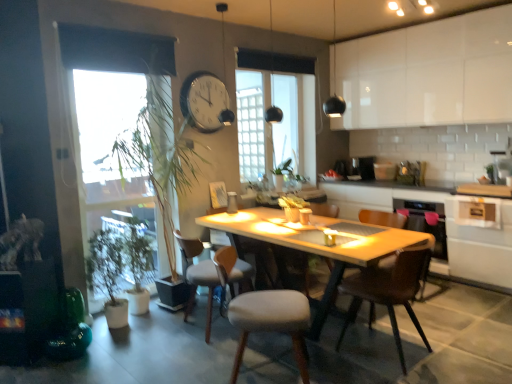
Question: From the image's perspective, is clear glass window at center located above or below white glossy counter at center?

Choices:
 (A) below
 (B) above

Answer: (B)

Question: From a real-world perspective, relative to white glossy counter at center, is clear glass window at center vertically above or below?

Choices:
 (A) below
 (B) above

Answer: (B)

Question: Which of these objects is positioned closest to the green leafy plant at left?

Choices:
 (A) white glossy cabinet at lower right, which is counted as the first cabinetry, starting from the bottom
 (B) light gray fabric chair at center, which appears as the first chair when viewed from the front
 (C) wooden chair at center, the first chair from the back
 (D) light gray fabric chair at center, positioned as the 3th chair in back-to-front order
 (E) white plastic clock at upper center

Answer: (D)

Question: Which is farther from the white glossy counter at center?

Choices:
 (A) white glossy cabinet at upper right, the 1th cabinetry in the top-to-bottom sequence
 (B) clear glass window at center
 (C) light gray fabric chair at center, arranged as the fifth chair when viewed from the back
 (D) light gray fabric chair at center, the second chair in the back-to-front sequence
 (E) white plastic clock at upper center

Answer: (C)